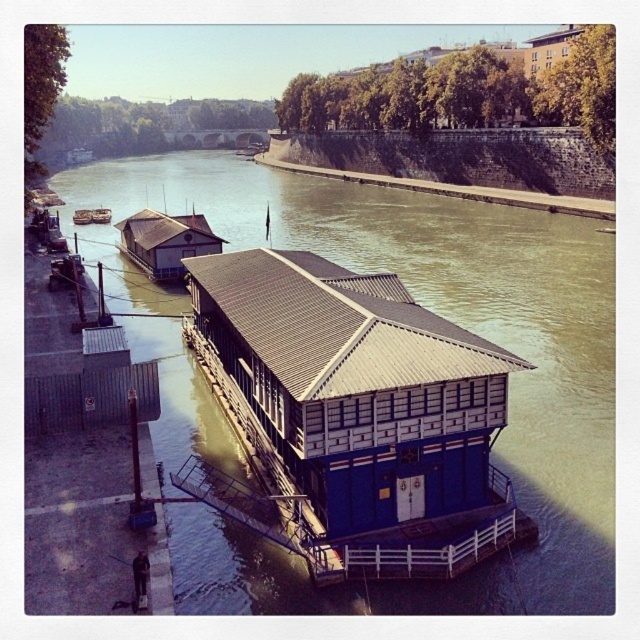
You are standing on the riverbank and see the blue wooden houseboat at center and the blue wooden hut at center. Which one is positioned higher in the image?

The blue wooden houseboat at center is positioned higher than the blue wooden hut at center in the image.

You are standing on the riverbank and see two blue structures floating on the river. Which one is more to the left, the blue wooden houseboat at center or the blue wooden hut at center?

The blue wooden houseboat at center is more to the left than the blue wooden hut at center.